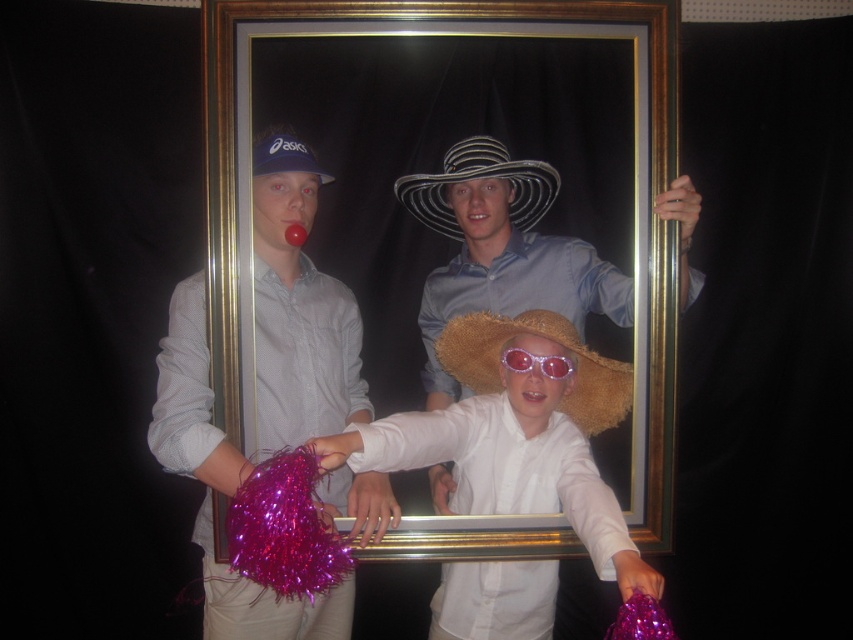
Question: Among these points, which one is nearest to the camera?

Choices:
 (A) (264, 147)
 (B) (491, 152)
 (C) (653, 211)
 (D) (579, 419)

Answer: (C)

Question: Observing the image, what is the correct spatial positioning of strawmaterial/texturecowboy hat at center in reference to black and white striped cowboy hat at center?

Choices:
 (A) left
 (B) right

Answer: (B)

Question: Can you confirm if gold metallic picture frame at center is wider than white straw hat at center?

Choices:
 (A) yes
 (B) no

Answer: (A)

Question: Is strawmaterial/texturecowboy hat at center further to camera compared to black and white striped cowboy hat at center?

Choices:
 (A) no
 (B) yes

Answer: (A)

Question: Estimate the real-world distances between objects in this image. Which object is farther from the white straw hat at center?

Choices:
 (A) pink reflective sunglasses at center
 (B) matte blue cap at upper left

Answer: (B)

Question: Which point is closer to the camera taking this photo?

Choices:
 (A) (590, 372)
 (B) (582, 362)

Answer: (B)